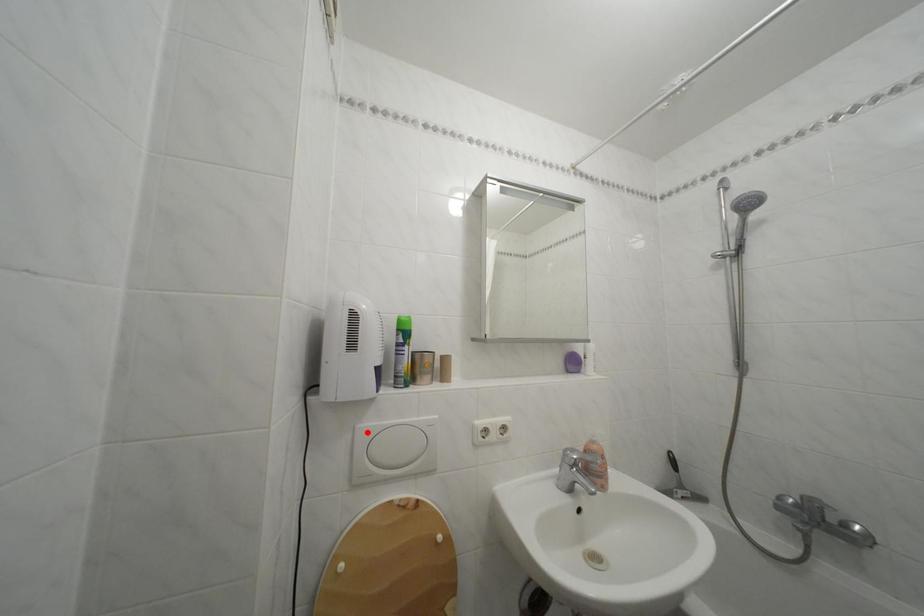
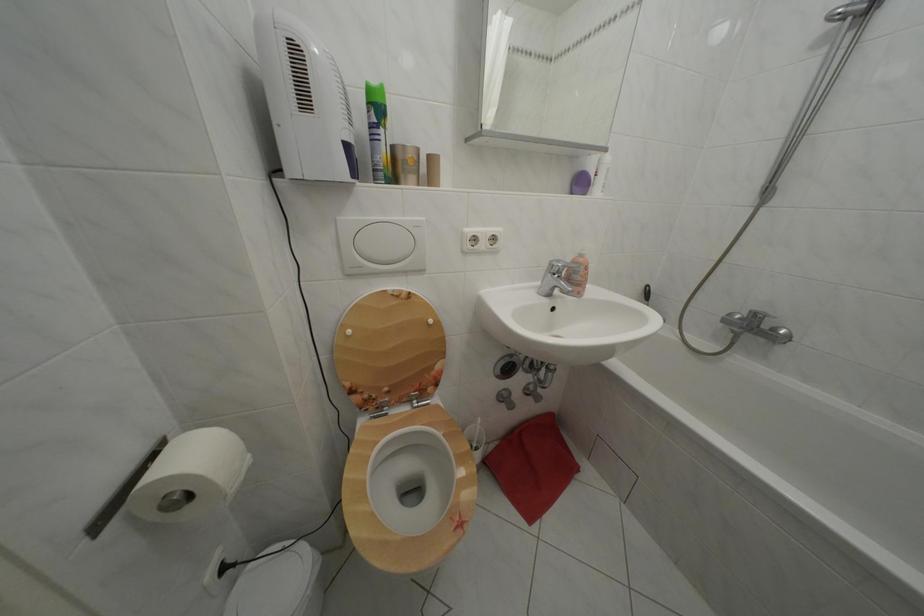
In the second image, find the point that corresponds to the highlighted location in the first image.

(348, 225)